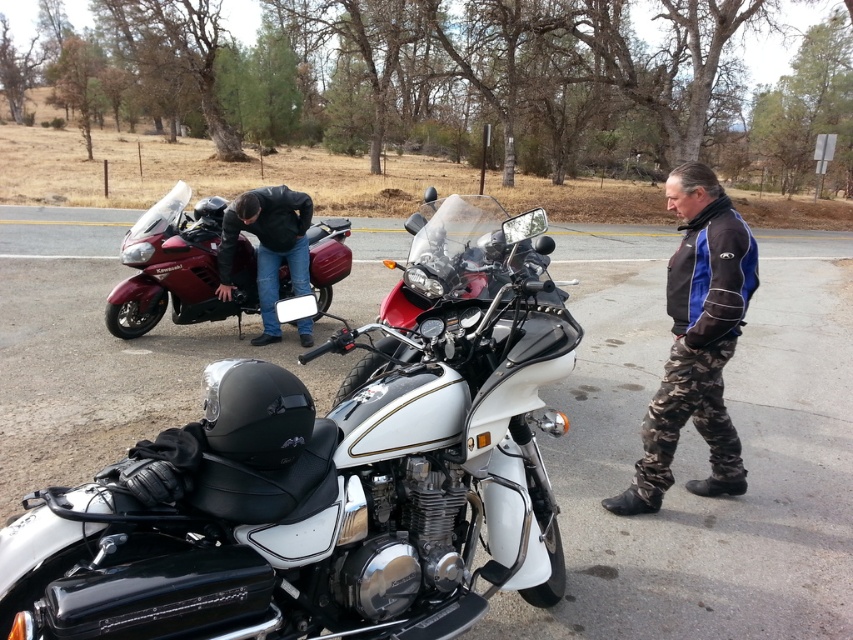
You are a photographer trying to capture both the shiny metallic motorcycle at center and the dark blue leather jacket at left in a single frame. Based on their positions, which object should you focus on first to ensure both are in the frame?

The shiny metallic motorcycle at center is positioned on the right side of dark blue leather jacket at left. To capture both in a single frame, focus on the dark blue leather jacket at left first since it is on the left side, allowing the motorcycle to be included on its right.

You are a delivery person who needs to place a GPS tracker on the shiny metallic motorcycle at center. The tracker must be placed at coordinates between 0.7 and 0.4 on the x and y axes respectively. Can you confirm if the motorcycle is positioned correctly for this task?

The shiny metallic motorcycle at center is positioned at point 0.750 on the x and 0.387 on the y axis. Since both coordinates fall within the required range of 0.7 to 0.4, the GPS tracker can be placed there.